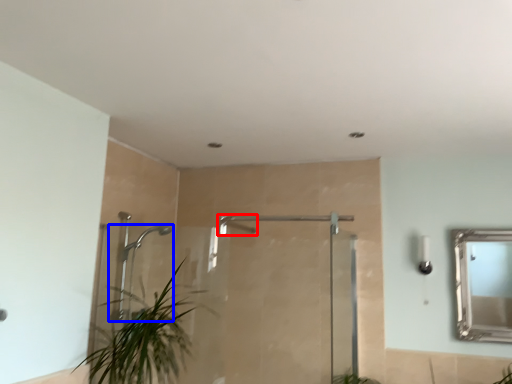
Question: Which object is closer to the camera taking this photo, shower (highlighted by a red box) or shower (highlighted by a blue box)?

Choices:
 (A) shower
 (B) shower

Answer: (A)